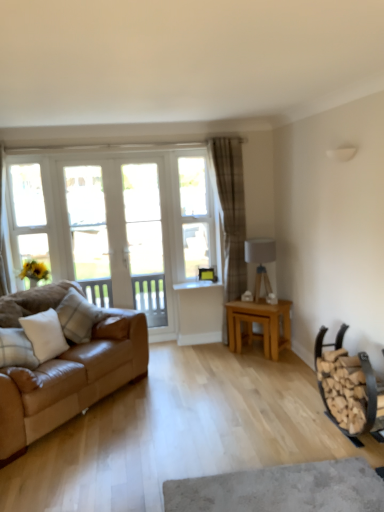
The image size is (384, 512). I want to click on vacant point to the right of leather couch at left, so click(x=196, y=386).